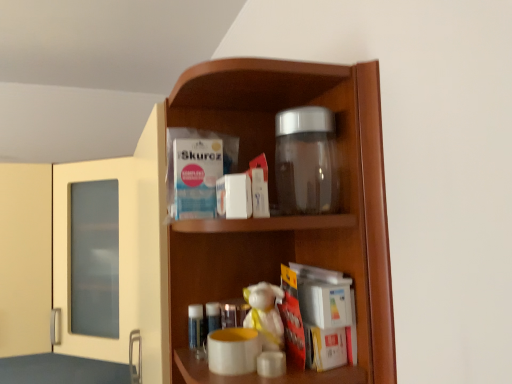
Question: From a real-world perspective, is white plush toy at center positioned under transparent glass jar at upper center based on gravity?

Choices:
 (A) yes
 (B) no

Answer: (A)

Question: From the image's perspective, is white plush toy at center on transparent glass jar at upper center?

Choices:
 (A) yes
 (B) no

Answer: (B)

Question: Is white plush toy at center surrounding transparent glass jar at upper center?

Choices:
 (A) no
 (B) yes

Answer: (A)

Question: Is white plush toy at center next to transparent glass jar at upper center and touching it?

Choices:
 (A) no
 (B) yes

Answer: (A)

Question: Can you confirm if white plush toy at center is positioned to the left of transparent glass jar at upper center?

Choices:
 (A) yes
 (B) no

Answer: (A)

Question: Considering the relative positions of transparent glass jar at upper center and transparent glass jar at upper center in the image provided, is transparent glass jar at upper center to the left or to the right of transparent glass jar at upper center?

Choices:
 (A) right
 (B) left

Answer: (B)

Question: Looking at their shapes, would you say transparent glass jar at upper center is wider or thinner than transparent glass jar at upper center?

Choices:
 (A) wide
 (B) thin

Answer: (A)

Question: In terms of height, does transparent glass jar at upper center look taller or shorter compared to transparent glass jar at upper center?

Choices:
 (A) short
 (B) tall

Answer: (B)

Question: Would you say transparent glass jar at upper center is inside or outside transparent glass jar at upper center?

Choices:
 (A) inside
 (B) outside

Answer: (B)

Question: Considering the positions of white plush toy at center and transparent glass jar at upper center in the image, is white plush toy at center wider or thinner than transparent glass jar at upper center?

Choices:
 (A) thin
 (B) wide

Answer: (A)

Question: From a real-world perspective, relative to transparent glass jar at upper center, is white plush toy at center vertically above or below?

Choices:
 (A) below
 (B) above

Answer: (A)

Question: Is white plush toy at center to the left or to the right of transparent glass jar at upper center in the image?

Choices:
 (A) left
 (B) right

Answer: (B)

Question: Considering the positions of white plush toy at center and transparent glass jar at upper center in the image, is white plush toy at center bigger or smaller than transparent glass jar at upper center?

Choices:
 (A) small
 (B) big

Answer: (A)

Question: From a real-world perspective, is transparent glass jar at upper center positioned above or below white plush toy at center?

Choices:
 (A) above
 (B) below

Answer: (A)

Question: From the image's perspective, is transparent glass jar at upper center located above or below white plush toy at center?

Choices:
 (A) below
 (B) above

Answer: (A)